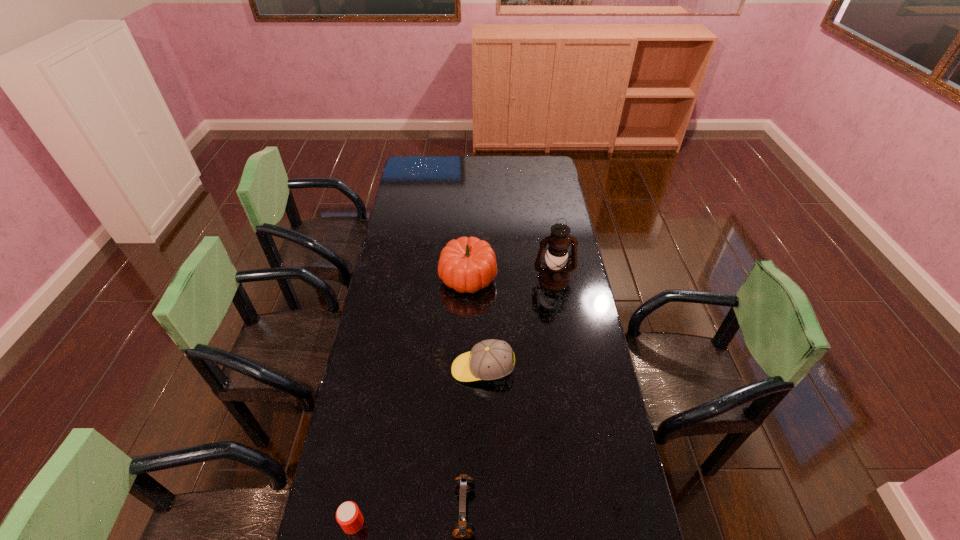
This screenshot has height=540, width=960. I want to click on vacant area that lies between the pumpkin and the tallest object, so click(x=511, y=278).

I want to click on free point between the beer can and the pumpkin, so click(411, 400).

The height and width of the screenshot is (540, 960). In order to click on empty location between the tallest object and the beer can in this screenshot , I will do `click(453, 401)`.

Locate an element on the screen. free space between the leftmost object and the lantern is located at coordinates (453, 401).

Find the location of a particular element. The width and height of the screenshot is (960, 540). vacant point located between the rightmost object and the second tallest object is located at coordinates (511, 278).

This screenshot has width=960, height=540. I want to click on unoccupied area between the rightmost object and the beer can, so click(453, 401).

Select which object appears as the closest to the lantern. Please provide its 2D coordinates. Your answer should be formatted as a tuple, i.e. [(x, y)], where the tuple contains the x and y coordinates of a point satisfying the conditions above.

[(466, 264)]

Identify which object is the fourth closest to the second tallest object. Please provide its 2D coordinates. Your answer should be formatted as a tuple, i.e. [(x, y)], where the tuple contains the x and y coordinates of a point satisfying the conditions above.

[(348, 515)]

Identify the location of vacant space that satisfies the following two spatial constraints: 1. on the side of the tallest object, there is a wick adjustment knob; 2. on the front-facing side of the baseball cap. (568, 369).

Where is `free space that satisfies the following two spatial constraints: 1. on the side of the rightmost object, there is a wick adjustment knob; 2. on the front-facing side of the third farthest object`? Image resolution: width=960 pixels, height=540 pixels. free space that satisfies the following two spatial constraints: 1. on the side of the rightmost object, there is a wick adjustment knob; 2. on the front-facing side of the third farthest object is located at coordinates (568, 369).